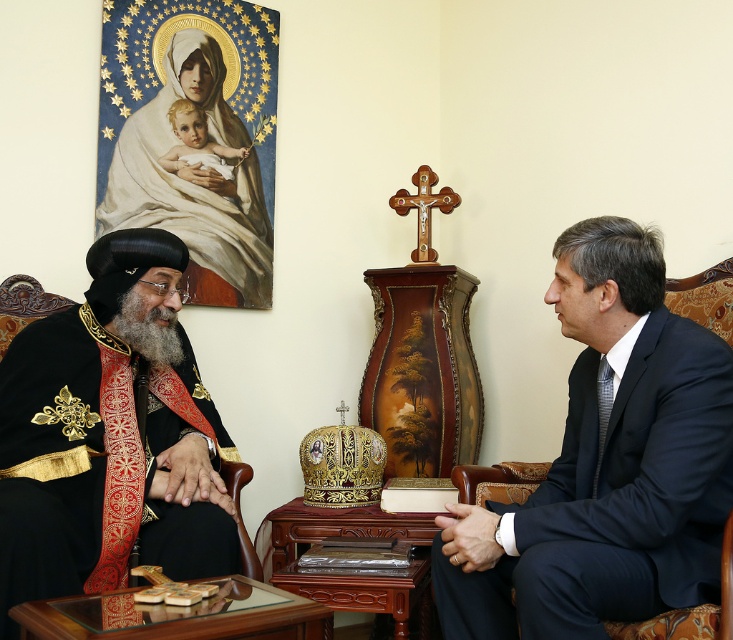
You are organizing a seating arrangement for an upcoming event. You have two chairs available, one that is 1.2 meters wide and another that is 1.5 meters wide. Based on the image, which chair should you choose for the person wearing the dark blue suit at right and which for the black velvet robe at left to ensure a proper fit?

The dark blue suit at right requires the 1.2 meters wide chair since its width is less than the black velvet robe at left, which needs the 1.5 meters wide chair.

You are organizing a photo shoot for a magazine article about religious ceremonies. You need to position two key figures in the image so that their attire is clearly visible. Given the dark blue suit at right and the black velvet robe at left, which attire should you focus your camera on to capture the most detailed shot, and why?

The black velvet robe at left should be the focus because it occupies more space than the dark blue suit at right, allowing for a clearer and more detailed capture.

You are standing in the ceremonial room and need to locate two specific points marked in the scene. The first point is at coordinates point (679, 477) and the second at point (194, 435). Which point is closer to the viewer?

Point (679, 477) is in front of point (194, 435), so it is closer to the viewer.